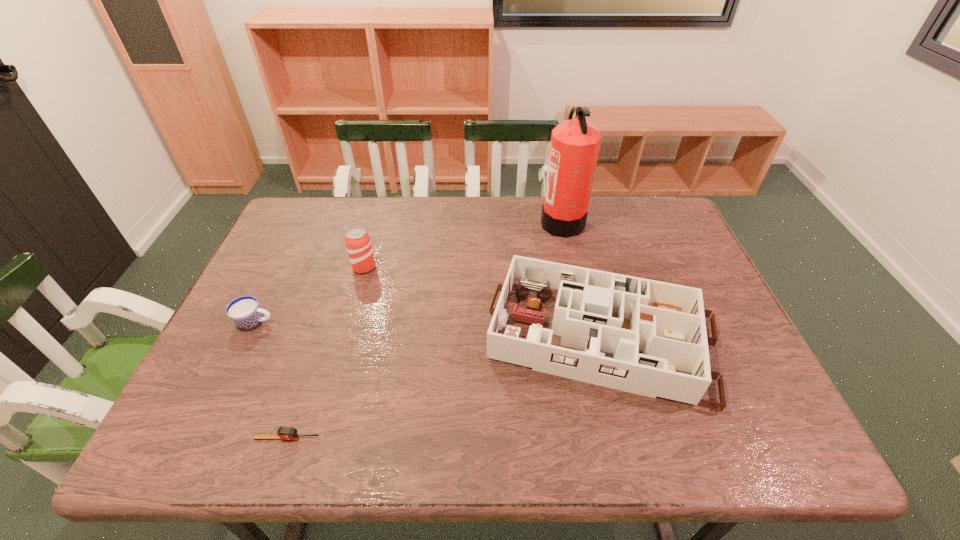
At what (x,y) coordinates should I click in order to perform the action: click on the farthest object. Please return your answer as a coordinate pair (x, y). Image resolution: width=960 pixels, height=540 pixels. Looking at the image, I should click on (575, 143).

The image size is (960, 540). What are the coordinates of `fire extinguisher` in the screenshot? It's located at (575, 143).

Locate an element on the screen. The width and height of the screenshot is (960, 540). beer can is located at coordinates (358, 244).

Locate an element on the screen. This screenshot has height=540, width=960. the fourth nearest object is located at coordinates (358, 244).

Where is `the third shortest object`? This screenshot has width=960, height=540. the third shortest object is located at coordinates (610, 316).

At what (x,y) coordinates should I click in order to perform the action: click on the leftmost object. Please return your answer as a coordinate pair (x, y). The image size is (960, 540). Looking at the image, I should click on (245, 312).

Where is `the second shortest object`? This screenshot has width=960, height=540. the second shortest object is located at coordinates (245, 312).

This screenshot has width=960, height=540. Identify the location of the shortest object. (284, 433).

This screenshot has height=540, width=960. Identify the location of tape measure. (284, 433).

The width and height of the screenshot is (960, 540). I want to click on vacant space located 0.050m on the front side of the tallest object, so click(525, 221).